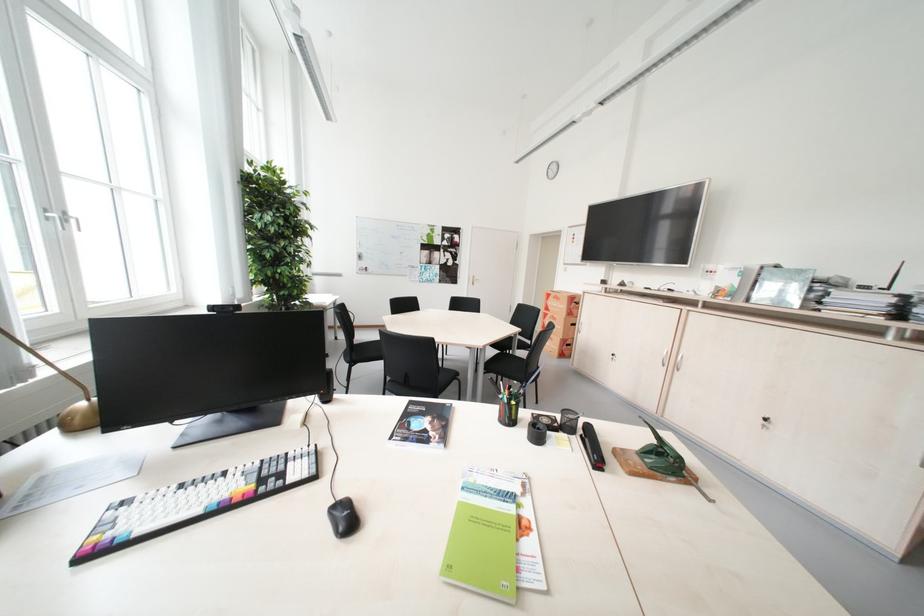
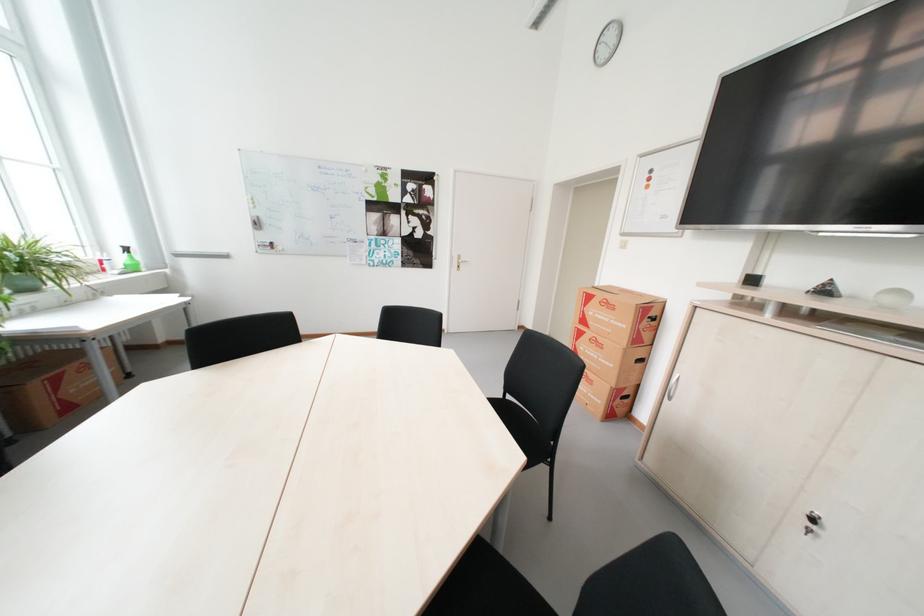
In the second image, find the point that corresponds to point (572, 347) in the first image.

(622, 400)